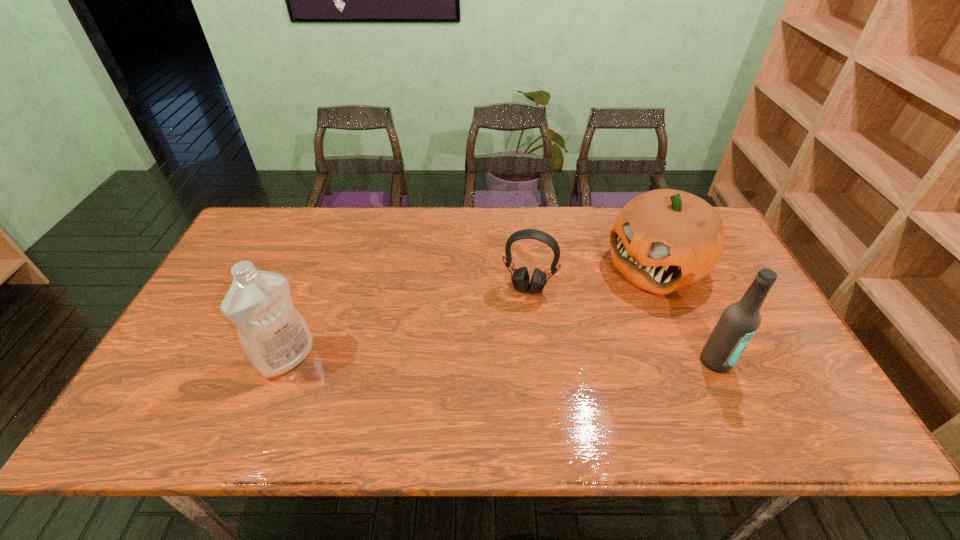
The image size is (960, 540). What are the coordinates of `the leftmost object` in the screenshot? It's located at (275, 338).

Locate an element on the screen. Image resolution: width=960 pixels, height=540 pixels. beer bottle is located at coordinates (739, 322).

You are a GUI agent. You are given a task and a screenshot of the screen. Output one action in this format:
    pyautogui.click(x=<x>, y=<y>)
    Task: Click on the pumpkin
    Image resolution: width=960 pixels, height=540 pixels.
    Given the screenshot: What is the action you would take?
    pyautogui.click(x=662, y=240)

Find the location of a particular element. This screenshot has height=540, width=960. the second object from left to right is located at coordinates (520, 279).

Identify the location of headset. (520, 279).

Where is `free location located on the left of the detergent`? Image resolution: width=960 pixels, height=540 pixels. free location located on the left of the detergent is located at coordinates (237, 357).

The height and width of the screenshot is (540, 960). In order to click on free region located 0.400m on the face of the pumpkin in this screenshot , I will do `click(521, 362)`.

Find the location of a particular element. The image size is (960, 540). vacant region located 0.310m on the face of the pumpkin is located at coordinates (547, 344).

Where is `vacant area located 0.170m on the face of the pumpkin`? The width and height of the screenshot is (960, 540). vacant area located 0.170m on the face of the pumpkin is located at coordinates (585, 318).

The image size is (960, 540). What are the coordinates of `vacant region located on the front-facing side of the headset` in the screenshot? It's located at (508, 354).